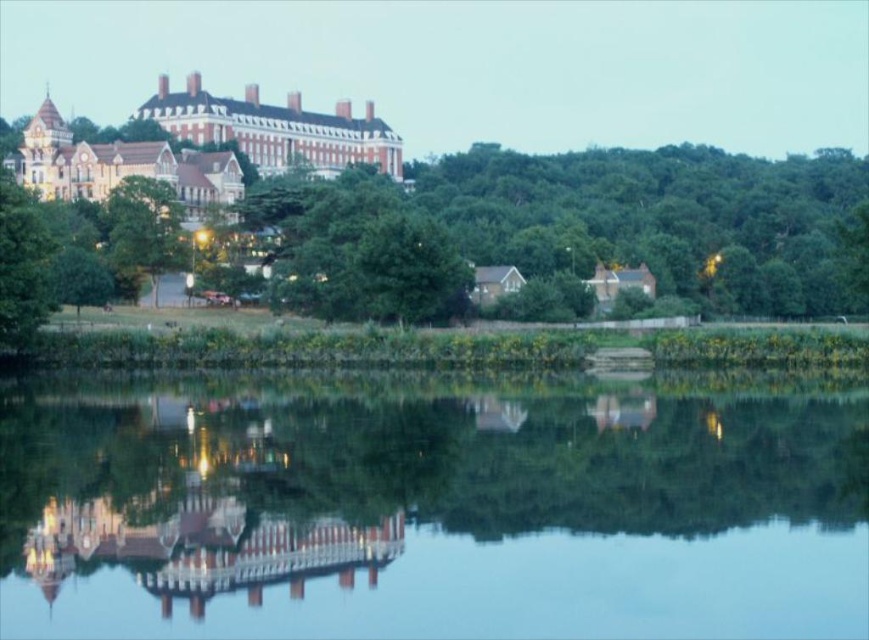
You are standing at the lakeside and want to take a photo that includes both the light brown stone building at upper center and the white stone palace at upper left. Which building should you position closer to the center of your camera frame to ensure both are fully visible in the photo?

You should position the light brown stone building at upper center closer to the center of your camera frame because it is taller than the white stone palace at upper left, which is shorter. This will help ensure both are fully visible in the photo.

You are a photographer planning to capture the reflection of the white stone palace at upper left in the transparent glass water at center. Based on their sizes, will the reflection of the palace be larger or smaller than the palace itself?

The transparent glass water at center is smaller than the white stone palace at upper left, so the reflection of the white stone palace at upper left in the transparent glass water at center will be smaller than the palace itself.

You are standing at the lakeside and want to take a photo that includes both the light brown stone building at upper center and the white stone palace at upper left. Which building should you position closer to the center of your camera frame to ensure both are visible in the reflection of the lake?

You should position the light brown stone building at upper center closer to the center of your camera frame because it is positioned over the white stone palace at upper left, so it is closer to the viewer and its reflection would be more prominent in the lake.